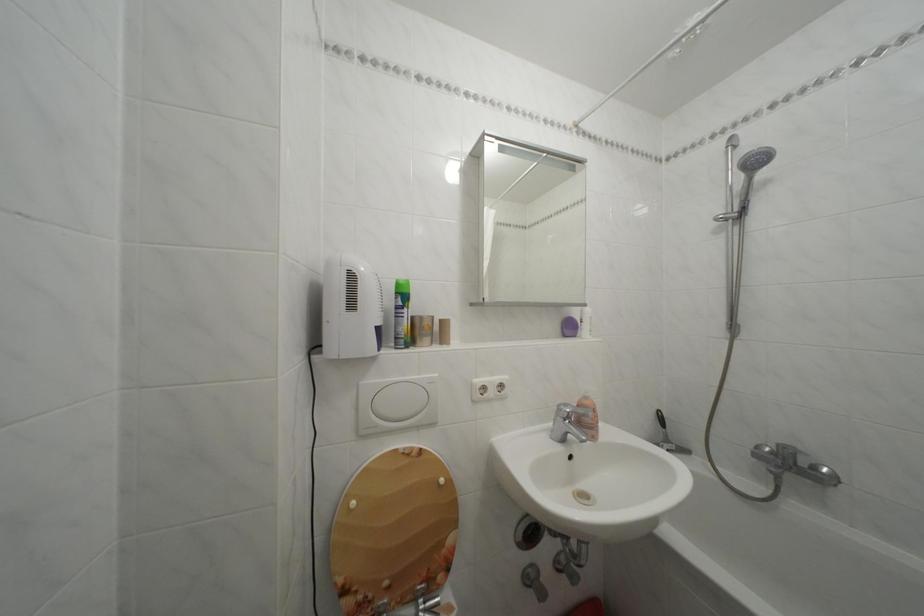
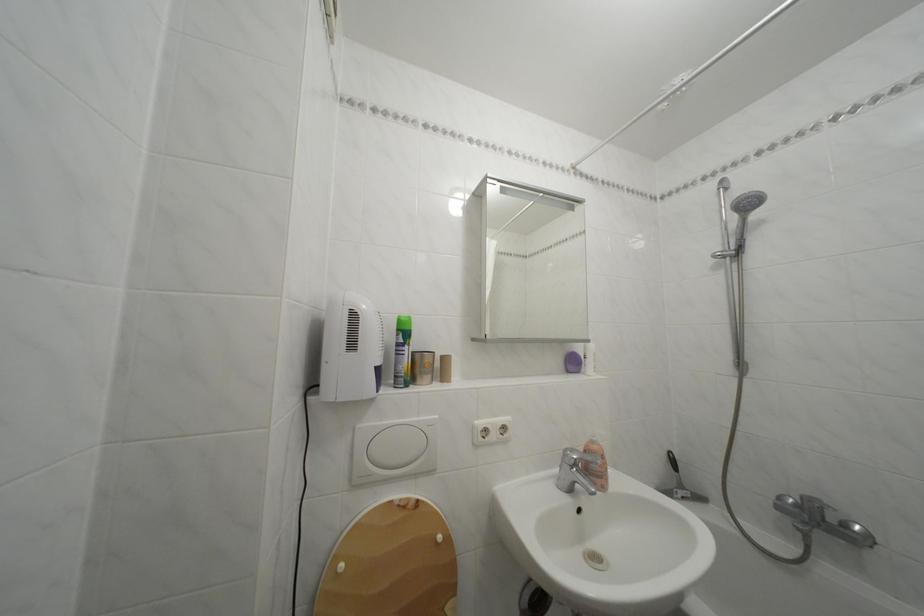
Locate, in the second image, the point that corresponds to [362,509] in the first image.

(350, 573)